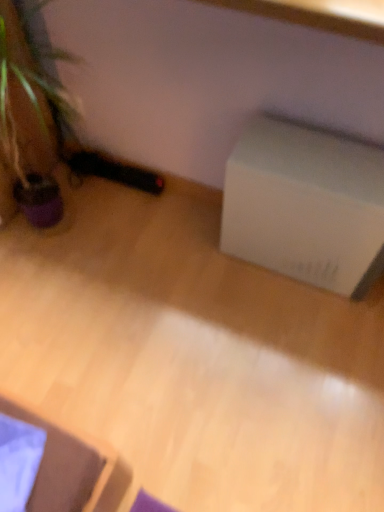
Based on the photo, measure the distance between white matte box at lower right and camera.

The distance of white matte box at lower right from camera is 3.44 feet.

I want to click on white matte box at lower right, so click(306, 205).

Describe the element at coordinates (306, 205) in the screenshot. The width and height of the screenshot is (384, 512). I see `white matte box at lower right` at that location.

This screenshot has height=512, width=384. Identify the location of white matte box at lower right. (306, 205).